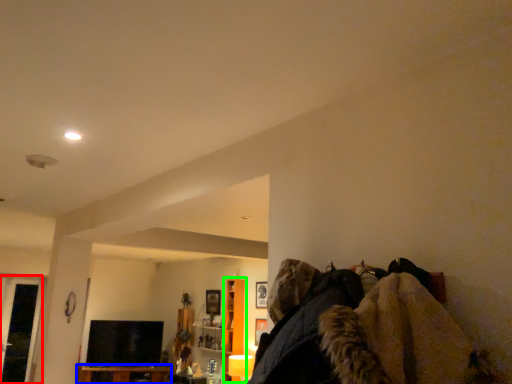
Question: Which is farther away from glass door (highlighted by a red box)? furniture (highlighted by a blue box) or cabinet (highlighted by a green box)?

Choices:
 (A) furniture
 (B) cabinet

Answer: (B)